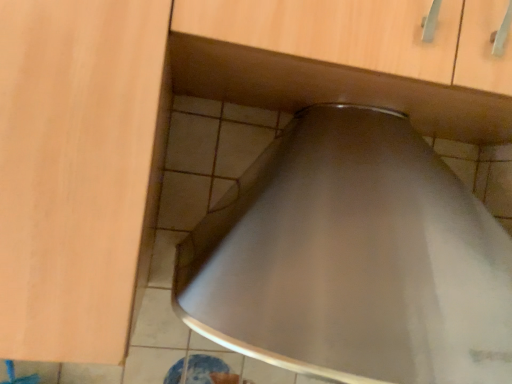
Locate an element on the screen. This screenshot has height=384, width=512. vacant point above stainless steel vent at center (from a real-world perspective) is located at coordinates (361, 89).